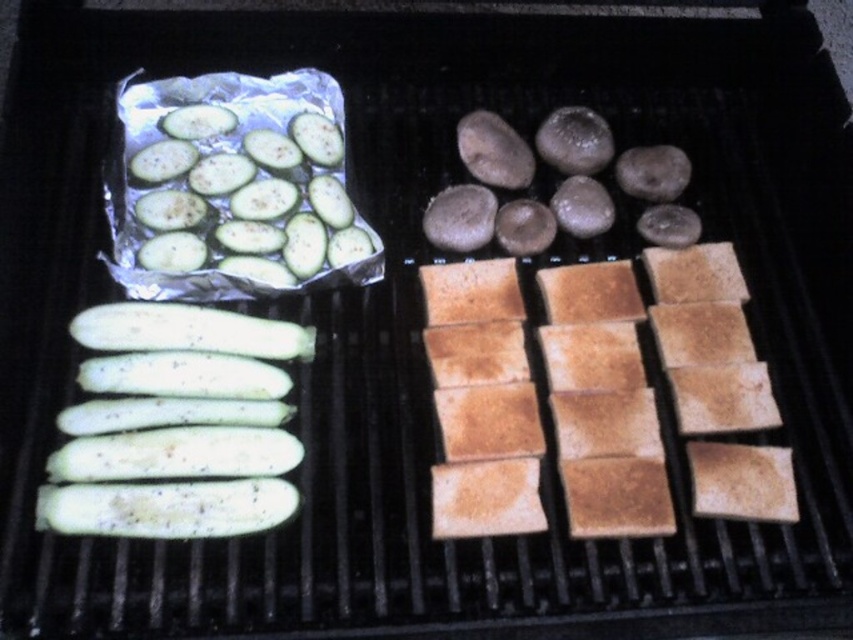
Question: Which object appears farthest from the camera in this image?

Choices:
 (A) green matte zucchini at upper left
 (B) green matte cucumber at left

Answer: (A)

Question: Can you confirm if green matte cucumber at left is wider than green matte zucchini at upper left?

Choices:
 (A) no
 (B) yes

Answer: (A)

Question: Can you confirm if green matte cucumber at left is thinner than green matte zucchini at upper left?

Choices:
 (A) yes
 (B) no

Answer: (A)

Question: Which of the following is the closest to the observer?

Choices:
 (A) green matte cucumber at left
 (B) green matte zucchini at upper left

Answer: (A)

Question: Which point appears farthest from the camera in this image?

Choices:
 (A) (128, 504)
 (B) (347, 211)

Answer: (B)

Question: Does green matte cucumber at left appear over green matte zucchini at upper left?

Choices:
 (A) yes
 (B) no

Answer: (B)